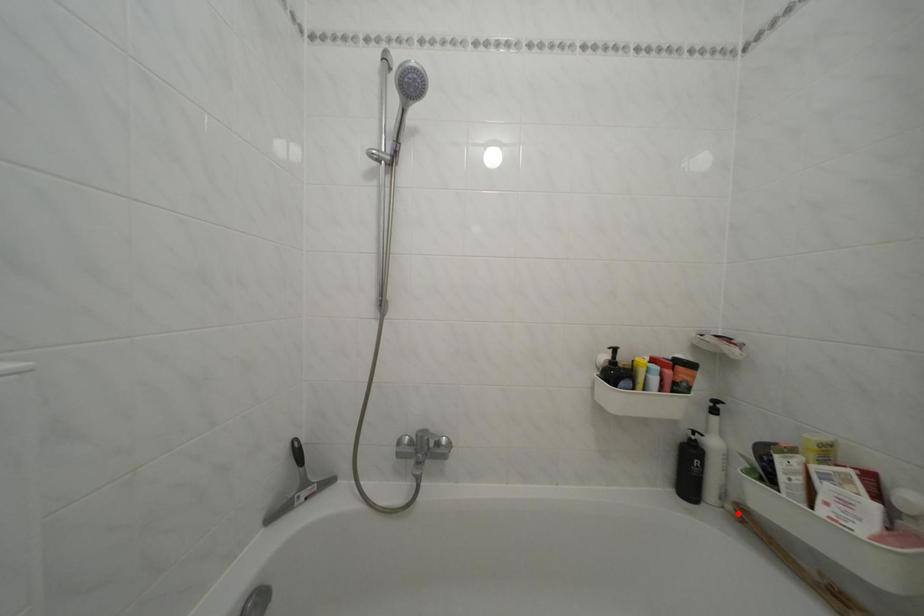
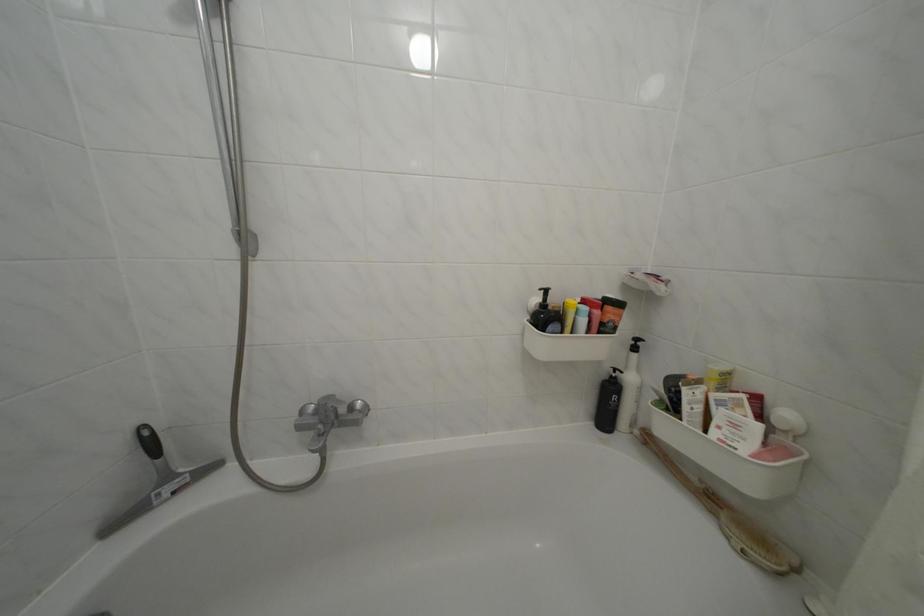
In the second image, find the point that corresponds to the highlighted location in the first image.

(646, 438)